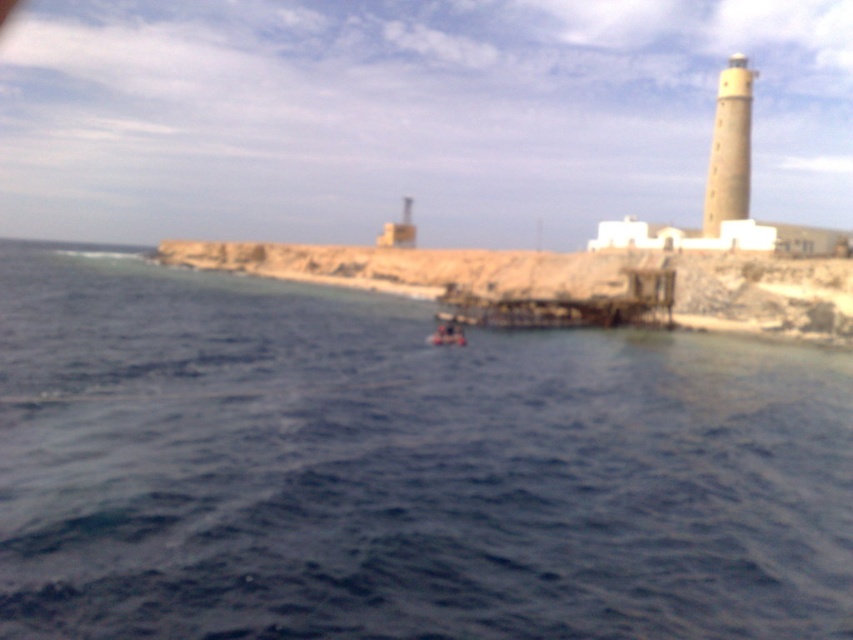
Question: Which is farther from the metallic red boat at center?

Choices:
 (A) brown rocky shoreline at center
 (B) beige concrete tower at upper right
 (C) blue water at center

Answer: (B)

Question: Which point is farther to the camera?

Choices:
 (A) blue water at center
 (B) beige concrete tower at upper right

Answer: (B)

Question: Which of the following is the closest to the observer?

Choices:
 (A) brown rocky shoreline at center
 (B) metallic red boat at center
 (C) beige concrete tower at upper right
 (D) blue water at center

Answer: (D)

Question: Does brown rocky shoreline at center lie behind beige concrete tower at upper right?

Choices:
 (A) yes
 (B) no

Answer: (B)

Question: Can you confirm if brown rocky shoreline at center is smaller than beige concrete tower at upper right?

Choices:
 (A) no
 (B) yes

Answer: (B)

Question: Can you confirm if beige concrete tower at upper right is thinner than metallic red boat at center?

Choices:
 (A) yes
 (B) no

Answer: (B)